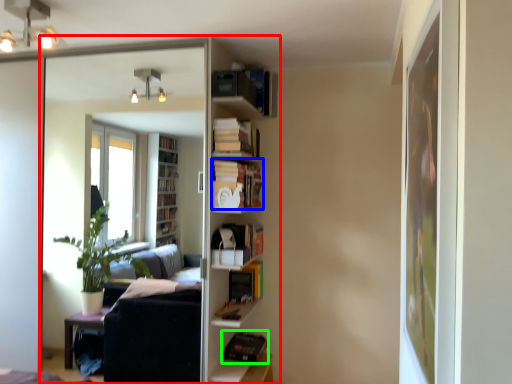
Question: Which is farther away from entertainment center (highlighted by a red box)? book (highlighted by a blue box) or book (highlighted by a green box)?

Choices:
 (A) book
 (B) book

Answer: (A)